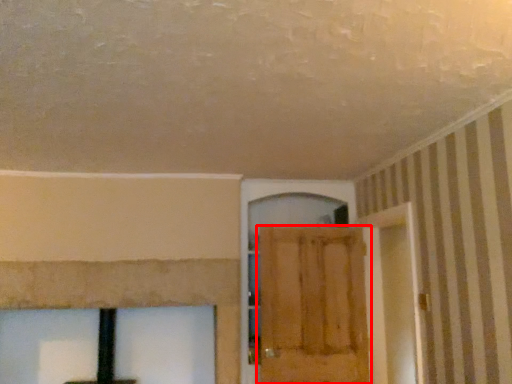
Question: Observing the image, what is the correct spatial positioning of door (annotated by the red box) in reference to screen door?

Choices:
 (A) right
 (B) left

Answer: (B)